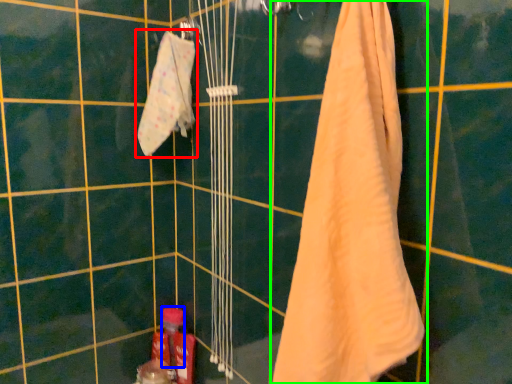
Question: Which object is positioned farthest from towel (highlighted by a red box)? Select from toiletry (highlighted by a blue box) and towel (highlighted by a green box).

Choices:
 (A) toiletry
 (B) towel

Answer: (A)